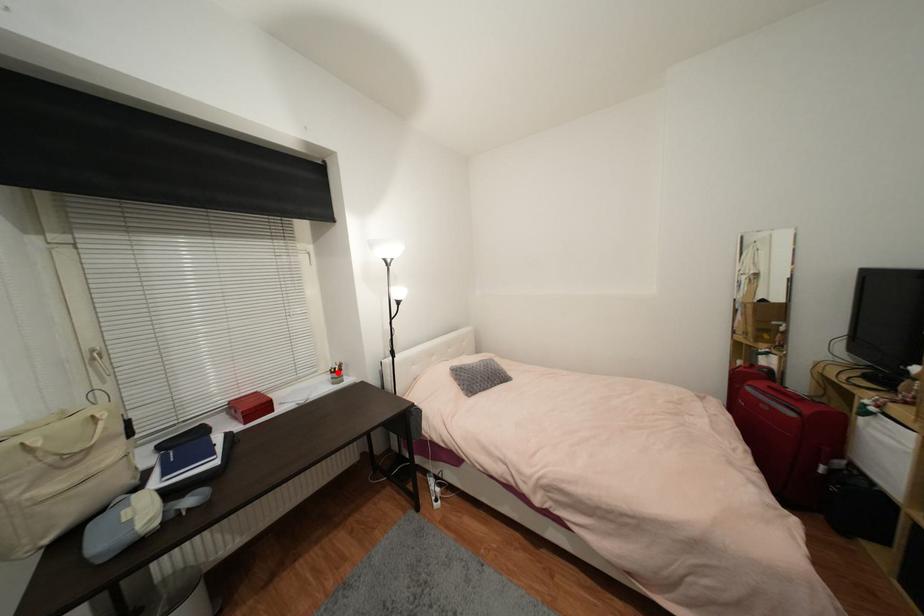
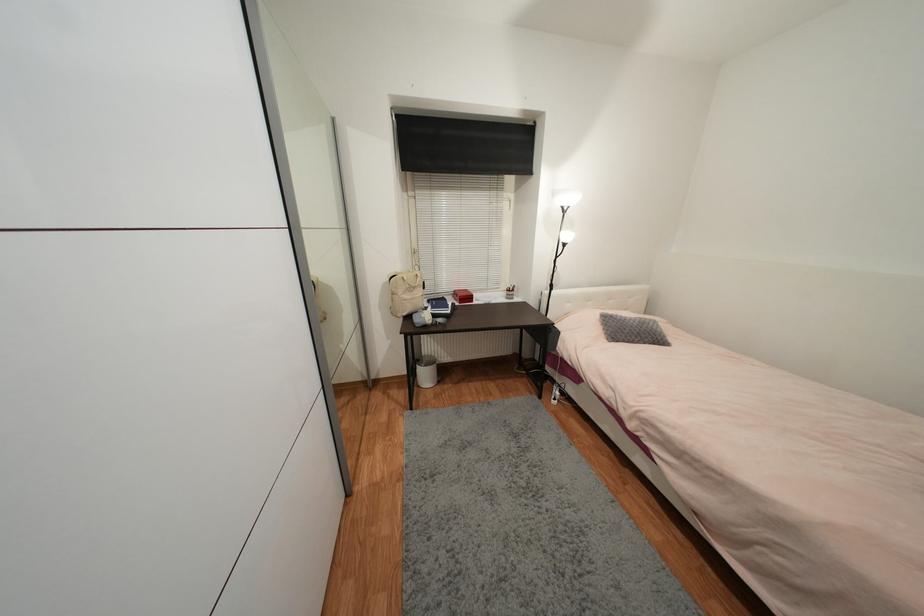
Where in the second image is the point corresponding to the highlighted location from the first image?

(513, 292)